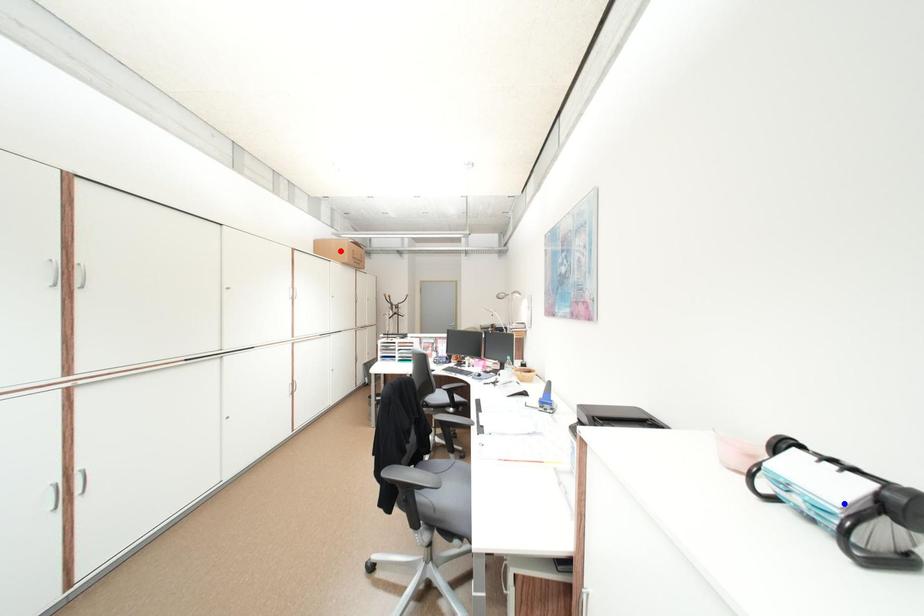
Question: Two points are marked on the image. Which point is closer to the camera?

Choices:
 (A) Blue point is closer.
 (B) Red point is closer.

Answer: (A)